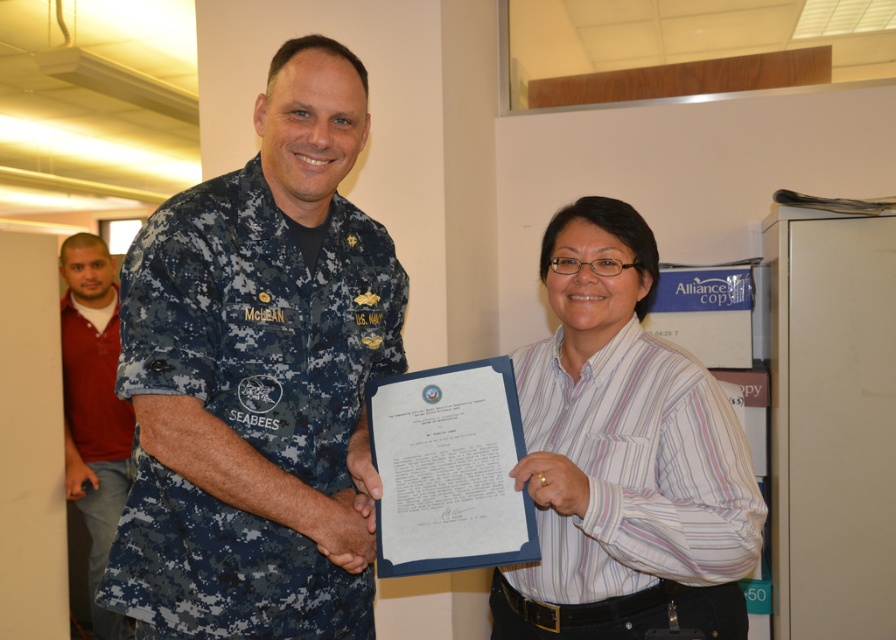
Question: Does white striped shirt at center come in front of red cotton shirt at left?

Choices:
 (A) yes
 (B) no

Answer: (A)

Question: From the image, what is the correct spatial relationship of white striped shirt at center in relation to red cotton shirt at left?

Choices:
 (A) below
 (B) above

Answer: (B)

Question: Which point appears farthest from the camera in this image?

Choices:
 (A) (522, 579)
 (B) (192, 522)

Answer: (A)

Question: Which object is positioned closest to the red cotton shirt at left?

Choices:
 (A) white striped shirt at center
 (B) digital camouflage uniform at center

Answer: (B)

Question: Estimate the real-world distances between objects in this image. Which object is farther from the digital camouflage uniform at center?

Choices:
 (A) red cotton shirt at left
 (B) white striped shirt at center

Answer: (A)

Question: Observing the image, what is the correct spatial positioning of digital camouflage uniform at center in reference to white striped shirt at center?

Choices:
 (A) left
 (B) right

Answer: (A)